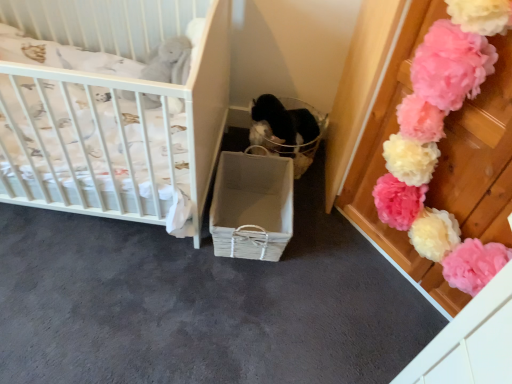
Identify the location of vacant space underneath white wicker basket at center (from a real-world perspective). This screenshot has height=384, width=512. (239, 206).